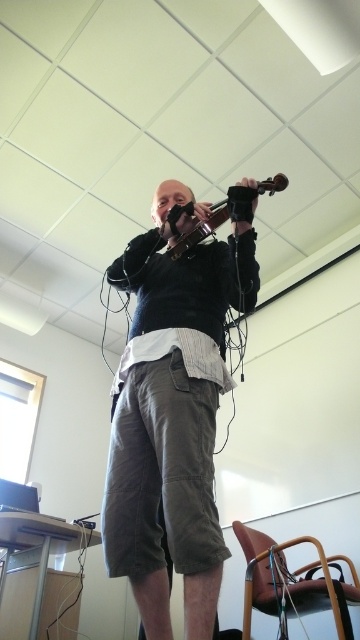
Question: Is dark gray cotton shorts at center further to the viewer compared to wooden violin at upper center?

Choices:
 (A) yes
 (B) no

Answer: (B)

Question: Which of the following is the farthest from the observer?

Choices:
 (A) (x=131, y=403)
 (B) (x=213, y=228)

Answer: (B)

Question: Which point is closer to the camera?

Choices:
 (A) wooden violin at upper center
 (B) dark gray cotton shorts at center

Answer: (B)

Question: From the image, what is the correct spatial relationship of dark gray cotton shorts at center in relation to wooden violin at upper center?

Choices:
 (A) left
 (B) right

Answer: (A)

Question: Does dark gray cotton shorts at center have a smaller size compared to wooden violin at upper center?

Choices:
 (A) yes
 (B) no

Answer: (B)

Question: Which object appears closest to the camera in this image?

Choices:
 (A) wooden violin at upper center
 (B) dark gray cotton shorts at center

Answer: (B)